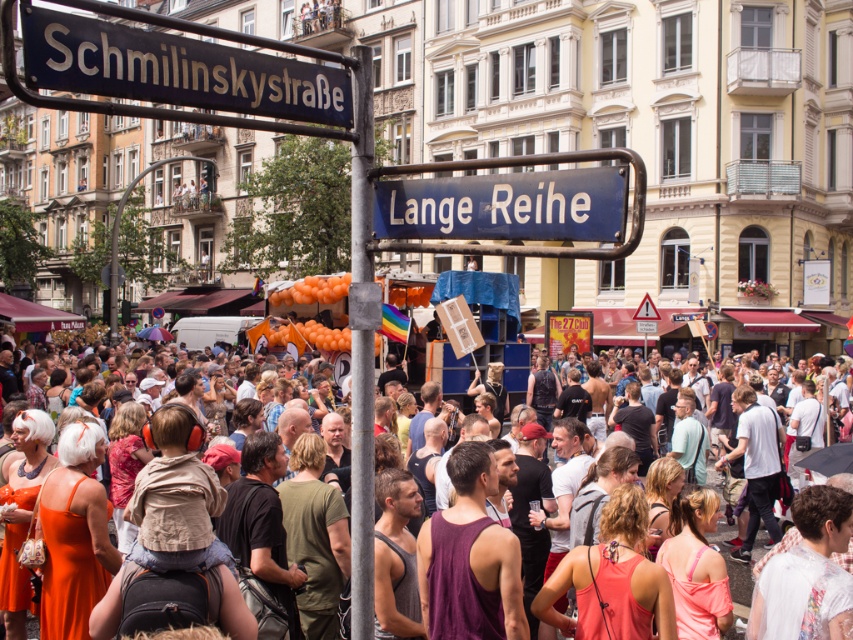
Which is above, blue metallic street sign at upper left or metallic pole at center?

blue metallic street sign at upper left is above.

Can you confirm if blue metallic street sign at upper left is positioned to the right of metallic pole at center?

No, blue metallic street sign at upper left is not to the right of metallic pole at center.

Where is `blue metallic street sign at upper left`? The image size is (853, 640). blue metallic street sign at upper left is located at coordinates (177, 68).

Is blue metallic street sign at upper left thinner than blue metallic street sign at upper center?

Yes, blue metallic street sign at upper left is thinner than blue metallic street sign at upper center.

Who is shorter, blue metallic street sign at upper left or blue metallic street sign at upper center?

blue metallic street sign at upper left is shorter.

At what (x,y) coordinates should I click in order to perform the action: click on blue metallic street sign at upper left. Please return your answer as a coordinate pair (x, y). Looking at the image, I should click on (177, 68).

The height and width of the screenshot is (640, 853). I want to click on blue metallic street sign at upper left, so click(x=177, y=68).

Between point (376, 195) and point (451, 364), which one is positioned in front?

Point (376, 195) is more forward.

The width and height of the screenshot is (853, 640). Find the location of `blue metallic street sign at upper center`. blue metallic street sign at upper center is located at coordinates (505, 205).